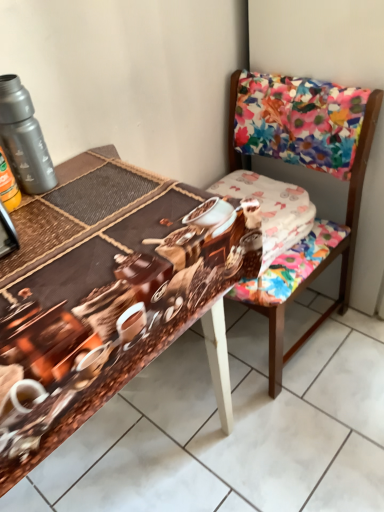
Question: From a real-world perspective, is floral fabric chair at upper right over white cotton fabric at center?

Choices:
 (A) yes
 (B) no

Answer: (B)

Question: Does floral fabric chair at upper right have a lesser height compared to white cotton fabric at center?

Choices:
 (A) no
 (B) yes

Answer: (A)

Question: Is floral fabric chair at upper right outside of white cotton fabric at center?

Choices:
 (A) yes
 (B) no

Answer: (A)

Question: Is floral fabric chair at upper right oriented away from white cotton fabric at center?

Choices:
 (A) yes
 (B) no

Answer: (A)

Question: Considering the relative positions of floral fabric chair at upper right and white cotton fabric at center in the image provided, is floral fabric chair at upper right behind white cotton fabric at center?

Choices:
 (A) yes
 (B) no

Answer: (B)

Question: Is metallic gray thermos at upper left situated inside brown printed fabric at center or outside?

Choices:
 (A) outside
 (B) inside

Answer: (A)

Question: From a real-world perspective, relative to brown printed fabric at center, is metallic gray thermos at upper left vertically above or below?

Choices:
 (A) below
 (B) above

Answer: (B)

Question: Looking at their shapes, would you say metallic gray thermos at upper left is wider or thinner than brown printed fabric at center?

Choices:
 (A) wide
 (B) thin

Answer: (B)

Question: In terms of size, does metallic gray thermos at upper left appear bigger or smaller than brown printed fabric at center?

Choices:
 (A) big
 (B) small

Answer: (B)

Question: Do you think white cotton fabric at center is within metallic gray thermos at upper left, or outside of it?

Choices:
 (A) inside
 (B) outside

Answer: (B)

Question: Looking at the image, does white cotton fabric at center seem bigger or smaller compared to metallic gray thermos at upper left?

Choices:
 (A) small
 (B) big

Answer: (B)

Question: From a real-world perspective, is white cotton fabric at center above or below metallic gray thermos at upper left?

Choices:
 (A) above
 (B) below

Answer: (B)

Question: From the image's perspective, relative to metallic gray thermos at upper left, is white cotton fabric at center above or below?

Choices:
 (A) above
 (B) below

Answer: (B)

Question: From the image's perspective, is floral fabric chair at upper right above or below white cotton fabric at center?

Choices:
 (A) above
 (B) below

Answer: (B)

Question: Based on their positions, is floral fabric chair at upper right located to the left or right of white cotton fabric at center?

Choices:
 (A) right
 (B) left

Answer: (A)